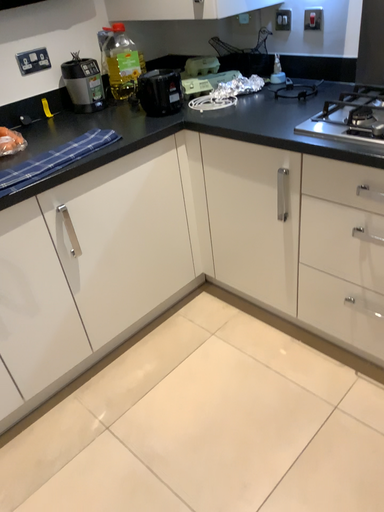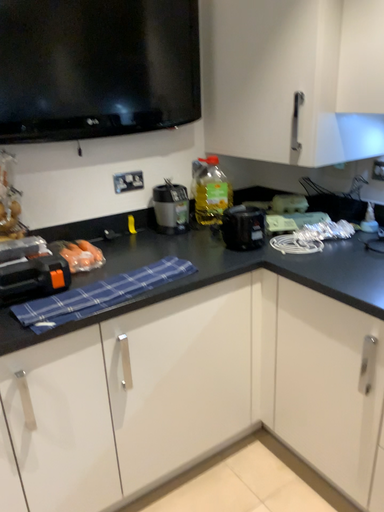
Question: How did the camera likely rotate when shooting the video?

Choices:
 (A) rotated downward
 (B) rotated upward

Answer: (B)